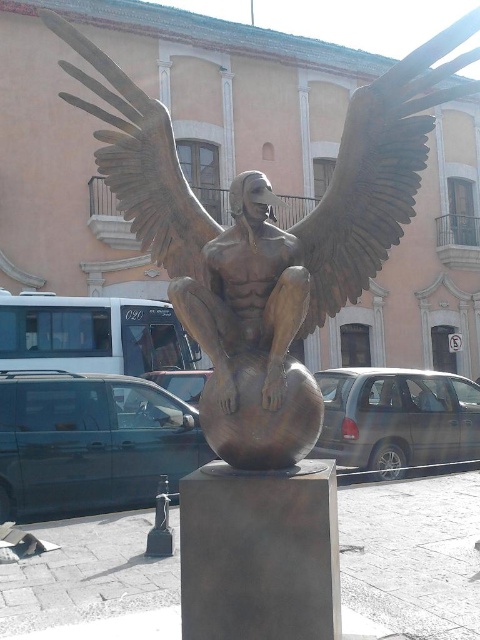
You are standing in front of the sculpture and want to take a photo of both the bronze statue at center and the bronze wings at upper left. Which direction should you turn to ensure both are in the frame?

The bronze statue at center is to the right of bronze wings at upper left, so you should turn to the left to include both in your photo.

You are standing in front of the bronze sculpture in the plaza. You notice two points marked on the sculpture. One is at coordinate point (369,266) and the other at point (169,163). Which point is nearer to you?

Point (369,266) is closer to the viewer than point (169,163).

You are standing at the origin point of the coordinate system. Where is the bronze statue at center located in terms of coordinates?

The bronze statue at center is located at point coordinates of (268, 237).